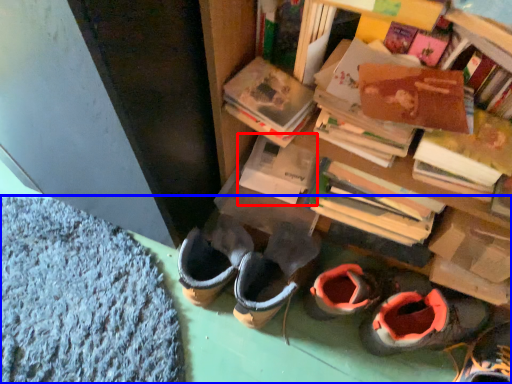
Question: Among these objects, which one is nearest to the camera, paperback book (highlighted by a red box) or carpets (highlighted by a blue box)?

Choices:
 (A) paperback book
 (B) carpets

Answer: (B)